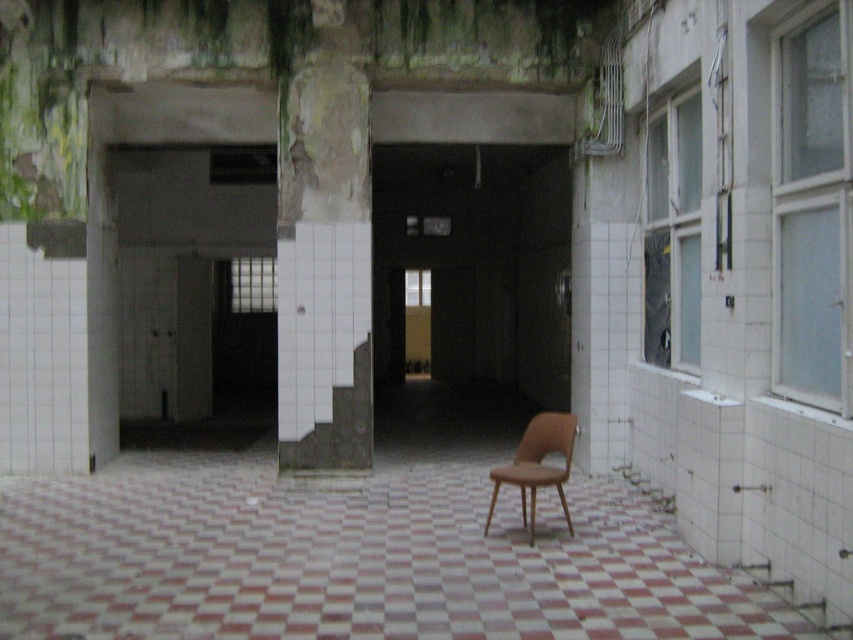
In the scene shown: You are standing in this abandoned space and want to place a small potted plant on a surface. The potted plant requires a flat, stable surface. Based on the scene, can you determine if the white checkered tile at center or the brown leather chair at center would be a suitable surface for placing the plant?

The white checkered tile at center is located below the brown leather chair at center, so the brown leather chair at center is above and would not provide a stable flat surface. The white checkered tile at center is a better option for placing the plant as it is a flat surface on the ground.

In the scene shown: You are standing in the abandoned indoor space and want to place a small potted plant on the floor. The potted plant is the same size as the brown leather chair at center. Will the white checkered tile at center be large enough to hold the plant?

The white checkered tile at center has a larger size compared to the brown leather chair at center, so yes, the white checkered tile at center can accommodate the potted plant since it is bigger than the chair.